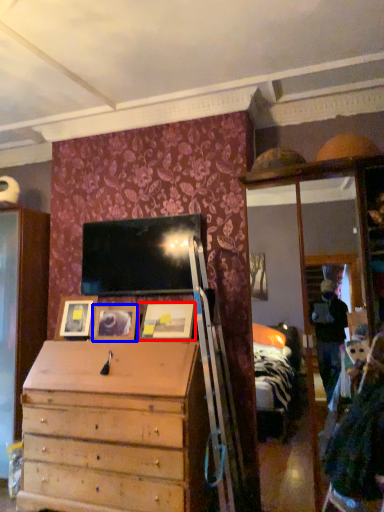
Question: Which of the following is the closest to the observer, picture frame (highlighted by a red box) or picture frame (highlighted by a blue box)?

Choices:
 (A) picture frame
 (B) picture frame

Answer: (A)